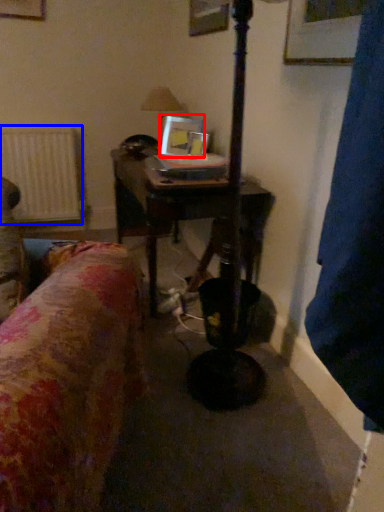
Question: Which object is closer to the camera taking this photo, picture frame (highlighted by a red box) or radiator (highlighted by a blue box)?

Choices:
 (A) picture frame
 (B) radiator

Answer: (A)